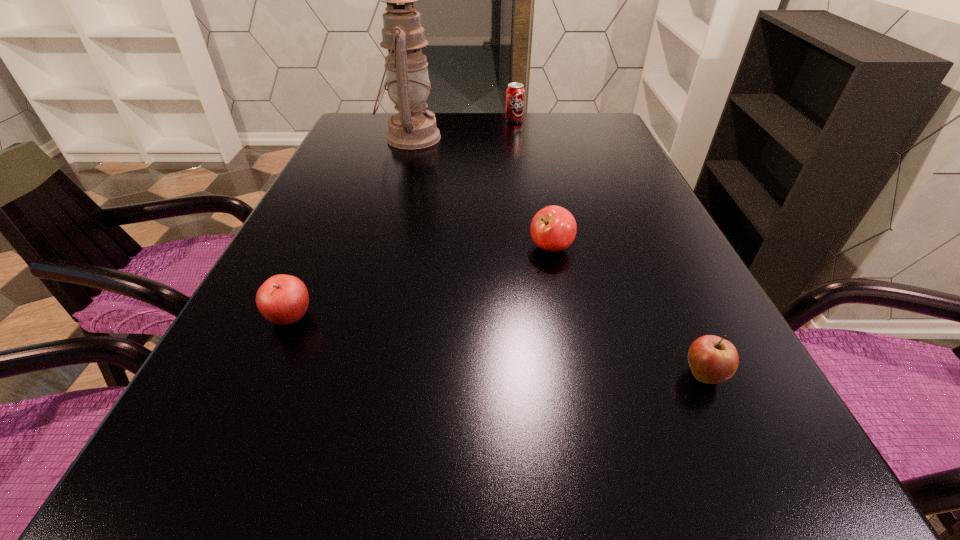
What are the coordinates of `empty location between the third nearest object and the oil lamp` in the screenshot? It's located at (481, 193).

Identify the location of vacant area between the nearest object and the soda. The image size is (960, 540). (x=609, y=247).

Image resolution: width=960 pixels, height=540 pixels. In order to click on empty space between the oil lamp and the third nearest object in this screenshot , I will do `click(481, 193)`.

Locate an element on the screen. The image size is (960, 540). vacant area between the second apple from right to left and the tallest object is located at coordinates pos(481,193).

The width and height of the screenshot is (960, 540). Identify the location of object that stands as the closest to the rightmost object. (553, 228).

Locate an element on the screen. The width and height of the screenshot is (960, 540). object that is the third closest to the oil lamp is located at coordinates (283, 299).

Point out which apple is positioned as the nearest to the farthest apple. Please provide its 2D coordinates. Your answer should be formatted as a tuple, i.e. [(x, y)], where the tuple contains the x and y coordinates of a point satisfying the conditions above.

[(712, 359)]

The image size is (960, 540). In order to click on the second closest apple to the oil lamp in this screenshot , I will do `click(283, 299)`.

The width and height of the screenshot is (960, 540). What are the coordinates of `free location that satisfies the following two spatial constraints: 1. on the back side of the soda; 2. on the left side of the tallest object` in the screenshot? It's located at (416, 120).